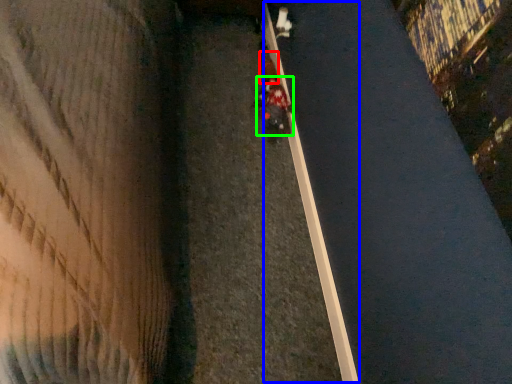
Question: Considering the real-world distances, which object is farthest from pedestrian (highlighted by a red box)? curb (highlighted by a blue box) or person (highlighted by a green box)?

Choices:
 (A) curb
 (B) person

Answer: (A)